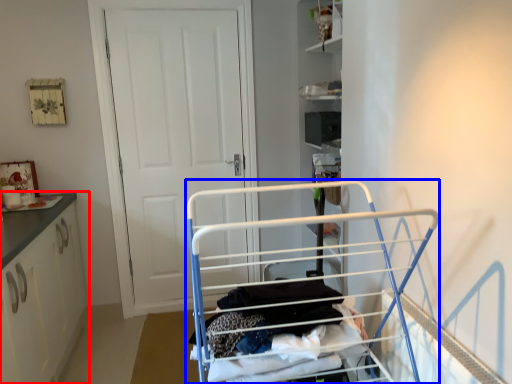
Question: Which object appears closest to the camera in this image, cabinetry (highlighted by a red box) or baby carriage (highlighted by a blue box)?

Choices:
 (A) cabinetry
 (B) baby carriage

Answer: (B)